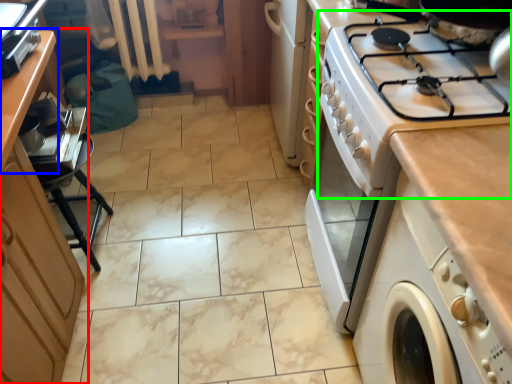
Question: Which object is the farthest from cabinetry (highlighted by a red box)? Choose among these: counter (highlighted by a blue box) or gas stove (highlighted by a green box).

Choices:
 (A) counter
 (B) gas stove

Answer: (B)